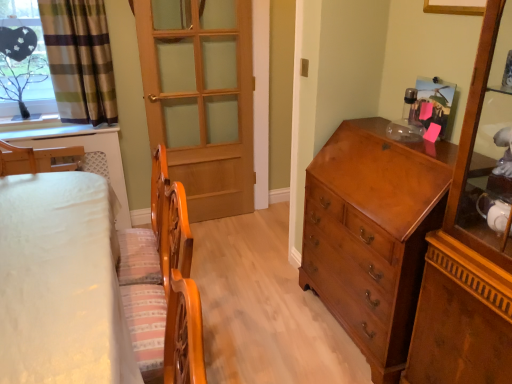
Question: Are white fabric bed at left and clear glass tree at upper left beside each other?

Choices:
 (A) yes
 (B) no

Answer: (B)

Question: Is white fabric bed at left to the right of clear glass tree at upper left from the viewer's perspective?

Choices:
 (A) no
 (B) yes

Answer: (B)

Question: From the image's perspective, is white fabric bed at left on top of clear glass tree at upper left?

Choices:
 (A) no
 (B) yes

Answer: (A)

Question: Is white fabric bed at left outside of clear glass tree at upper left?

Choices:
 (A) yes
 (B) no

Answer: (A)

Question: Can clear glass tree at upper left be found inside white fabric bed at left?

Choices:
 (A) no
 (B) yes

Answer: (A)

Question: Looking at the image, does clear glass tree at upper left seem bigger or smaller compared to wooden door at center?

Choices:
 (A) small
 (B) big

Answer: (A)

Question: Considering the positions of clear glass tree at upper left and wooden door at center in the image, is clear glass tree at upper left taller or shorter than wooden door at center?

Choices:
 (A) tall
 (B) short

Answer: (B)

Question: Considering their positions, is clear glass tree at upper left located in front of or behind wooden door at center?

Choices:
 (A) behind
 (B) front

Answer: (B)

Question: Considering the positions of point (6, 97) and point (231, 64), is point (6, 97) closer or farther from the camera than point (231, 64)?

Choices:
 (A) closer
 (B) farther

Answer: (A)

Question: In terms of size, does green plaid fabric at upper left appear bigger or smaller than shiny brown cabinet at right?

Choices:
 (A) big
 (B) small

Answer: (B)

Question: Visually, is green plaid fabric at upper left positioned to the left or to the right of shiny brown cabinet at right?

Choices:
 (A) right
 (B) left

Answer: (B)

Question: Is point (70, 24) positioned closer to the camera than point (413, 360)?

Choices:
 (A) farther
 (B) closer

Answer: (A)

Question: In terms of height, does green plaid fabric at upper left look taller or shorter compared to shiny brown cabinet at right?

Choices:
 (A) tall
 (B) short

Answer: (B)

Question: Considering the positions of point (25, 261) and point (309, 188), is point (25, 261) closer or farther from the camera than point (309, 188)?

Choices:
 (A) closer
 (B) farther

Answer: (A)

Question: From the image's perspective, relative to shiny brown wooden chest of drawers at right, is white fabric bed at left above or below?

Choices:
 (A) above
 (B) below

Answer: (B)